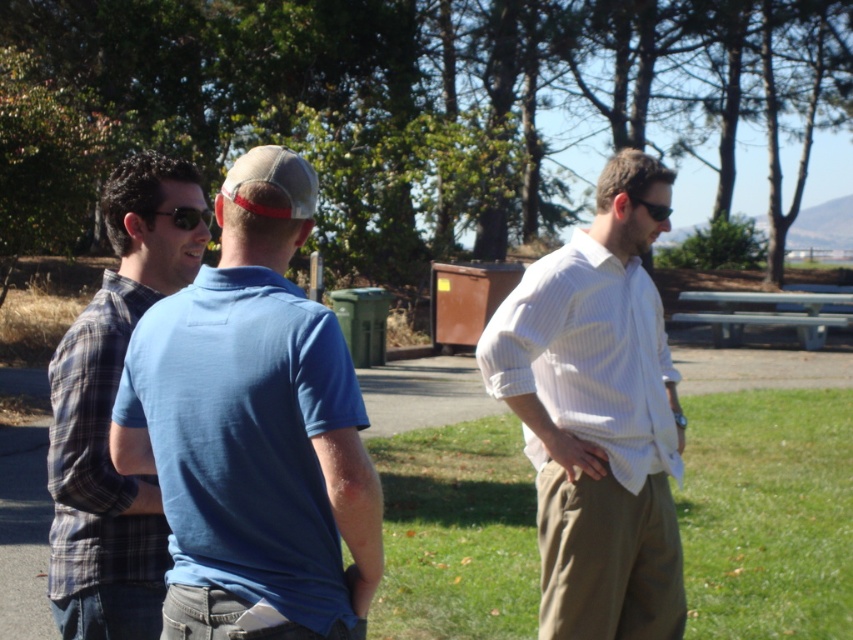
Between blue cotton polo shirt at center and white striped shirt at right, which one has less height?

white striped shirt at right

Does point (186, 337) come farther from viewer compared to point (492, 358)?

No, it is not.

Between point (268, 492) and point (515, 365), which one is positioned in front?

Point (268, 492) is in front.

I want to click on blue cotton polo shirt at center, so click(253, 429).

Which is behind, point (770, 406) or point (161, 554)?

The point (770, 406) is more distant.

Who is lower down, green grass at right or plaid cotton shirt at left?

green grass at right is lower down.

Locate an element on the screen. The image size is (853, 640). green grass at right is located at coordinates (769, 515).

Can you confirm if blue cotton polo shirt at center is positioned to the right of green grass at right?

Incorrect, blue cotton polo shirt at center is not on the right side of green grass at right.

Between point (109, 435) and point (512, 627), which one is positioned in front?

Point (109, 435) is in front.

Identify the location of blue cotton polo shirt at center. (253, 429).